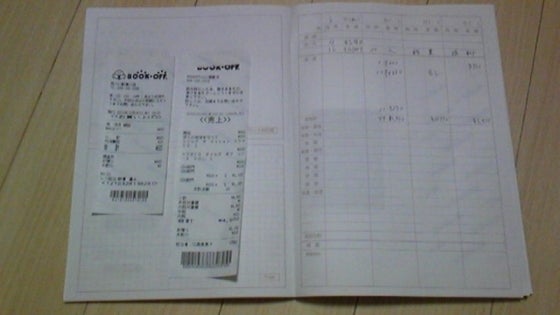
This screenshot has width=560, height=315. Find the location of `table`. table is located at coordinates (534, 176).